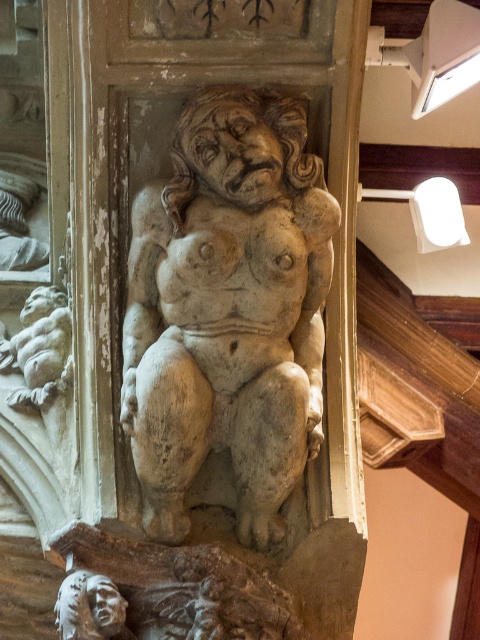
Who is taller, stone statue at center or white stone head at lower left?

With more height is stone statue at center.

This screenshot has width=480, height=640. What are the coordinates of `stone statue at center` in the screenshot? It's located at (228, 310).

Where is `stone statue at center`? stone statue at center is located at coordinates (228, 310).

Is stone statue at center to the left of smooth stone cherub at lower left from the viewer's perspective?

Incorrect, stone statue at center is not on the left side of smooth stone cherub at lower left.

Is stone statue at center closer to the viewer compared to smooth stone cherub at lower left?

Yes, it is in front of smooth stone cherub at lower left.

Image resolution: width=480 pixels, height=640 pixels. Describe the element at coordinates (228, 310) in the screenshot. I see `stone statue at center` at that location.

At what (x,y) coordinates should I click in order to perform the action: click on stone statue at center. Please return your answer as a coordinate pair (x, y). Image resolution: width=480 pixels, height=640 pixels. Looking at the image, I should click on (228, 310).

Locate an element on the screen. This screenshot has height=640, width=480. smooth stone cherub at lower left is located at coordinates (39, 348).

Does smooth stone cherub at lower left appear on the right side of white stone head at lower left?

In fact, smooth stone cherub at lower left is to the left of white stone head at lower left.

Is point (62, 333) positioned after point (71, 584)?

Yes, point (62, 333) is farther from viewer.

Locate an element on the screen. smooth stone cherub at lower left is located at coordinates (39, 348).